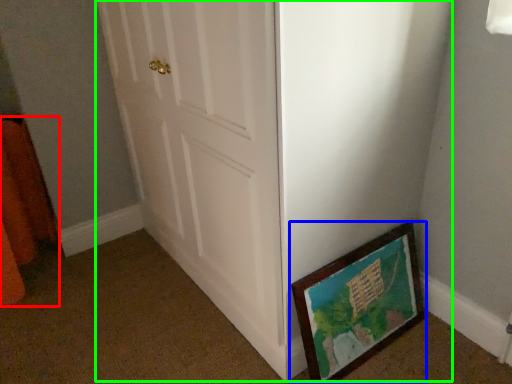
Question: Which object is positioned farthest from curtain (highlighted by a red box)? Select from picture frame (highlighted by a blue box) and door (highlighted by a green box).

Choices:
 (A) picture frame
 (B) door

Answer: (A)